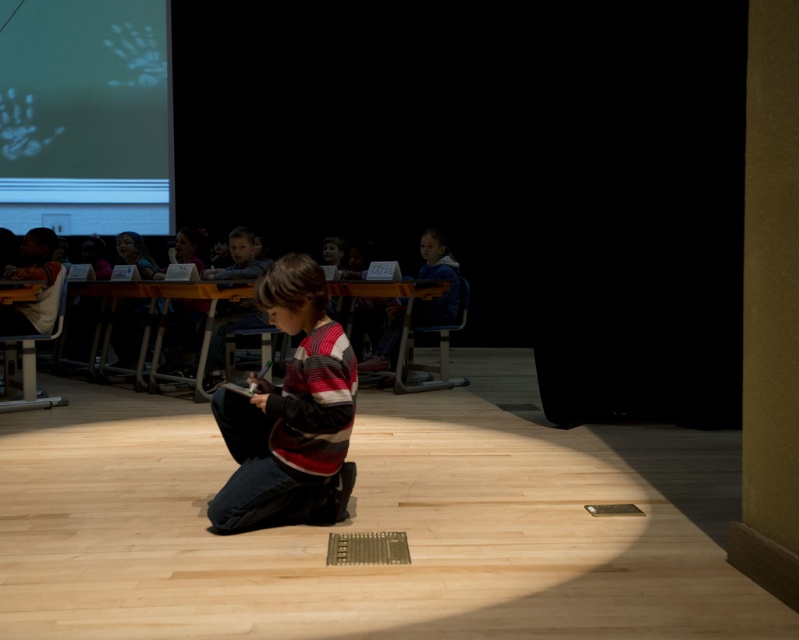
Looking at this image, who is lower down, striped sweater at center or blue fleece jacket at center?

striped sweater at center is lower down.

Which is more to the right, striped sweater at center or blue fleece jacket at center?

blue fleece jacket at center is more to the right.

Which is behind, point (309, 500) or point (432, 314)?

Point (432, 314)

Identify the location of striped sweater at center. (289, 413).

Is white matte projection screen at upper left further to camera compared to blue fleece jacket at center?

Yes, it is behind blue fleece jacket at center.

Does white matte projection screen at upper left appear under blue fleece jacket at center?

No.

Which is in front, point (161, 19) or point (384, 353)?

Point (384, 353) is more forward.

Locate an element on the screen. white matte projection screen at upper left is located at coordinates (85, 115).

Does white matte projection screen at upper left appear under striped sweater at center?

Incorrect, white matte projection screen at upper left is not positioned below striped sweater at center.

Between white matte projection screen at upper left and striped sweater at center, which one is positioned lower?

striped sweater at center

Image resolution: width=799 pixels, height=640 pixels. I want to click on white matte projection screen at upper left, so click(x=85, y=115).